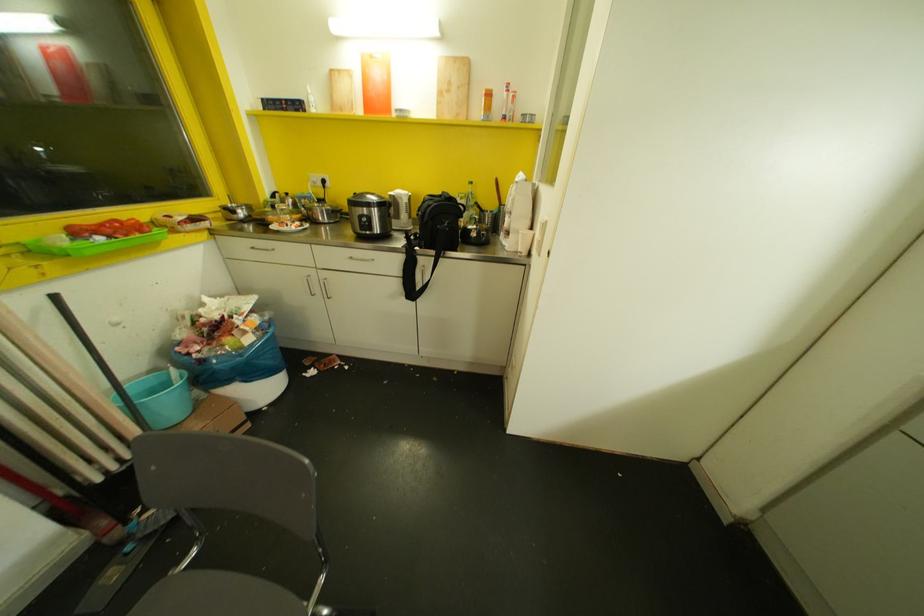
At what (x,y) coordinates should I click in order to perform the action: click on cooker lid handle. Please return your answer as a coordinate pair (x, y). The width and height of the screenshot is (924, 616). Looking at the image, I should click on (320, 199).